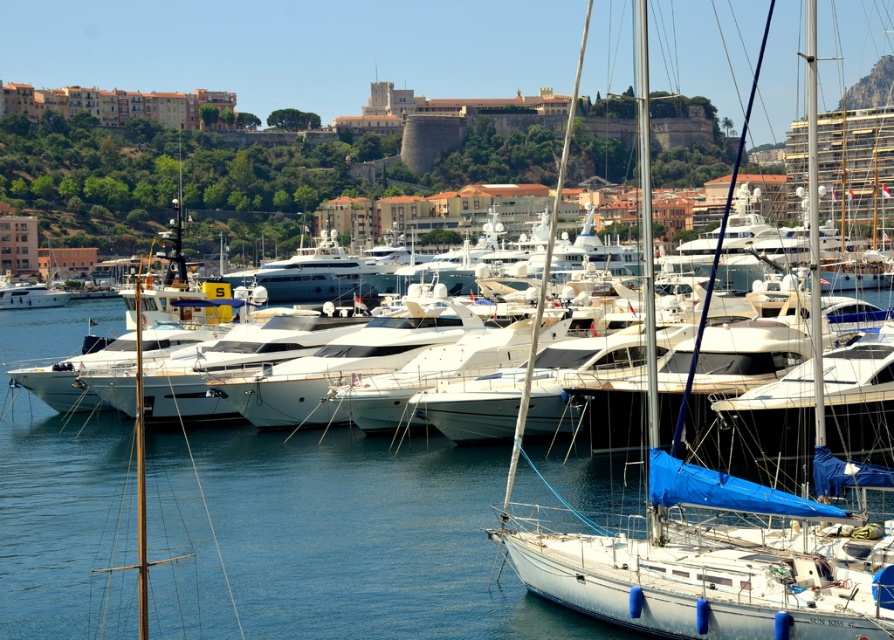
Question: In this image, where is clear blue water at center located relative to white glossy yacht at left?

Choices:
 (A) left
 (B) right

Answer: (B)

Question: Which is nearer to the white sailboat at center?

Choices:
 (A) clear blue water at center
 (B) white glossy yacht at left

Answer: (A)

Question: Estimate the real-world distances between objects in this image. Which object is farther from the white glossy yacht at left?

Choices:
 (A) clear blue water at center
 (B) white sailboat at center

Answer: (B)

Question: Can you confirm if clear blue water at center is positioned below white glossy yacht at left?

Choices:
 (A) yes
 (B) no

Answer: (A)

Question: Which is farther from the white glossy yacht at left?

Choices:
 (A) clear blue water at center
 (B) white sailboat at center

Answer: (B)

Question: Is clear blue water at center below white glossy yacht at left?

Choices:
 (A) no
 (B) yes

Answer: (B)